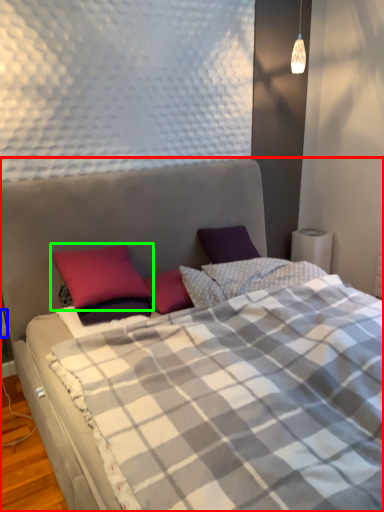
Question: Which object is positioned farthest from bed (highlighted by a red box)? Select from electric outlet (highlighted by a blue box) and pillow (highlighted by a green box).

Choices:
 (A) electric outlet
 (B) pillow

Answer: (A)